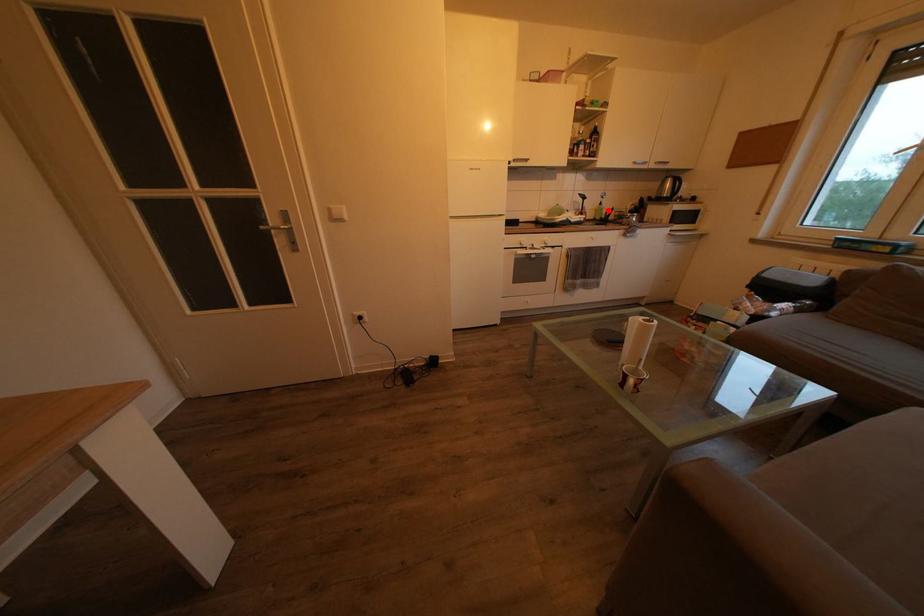
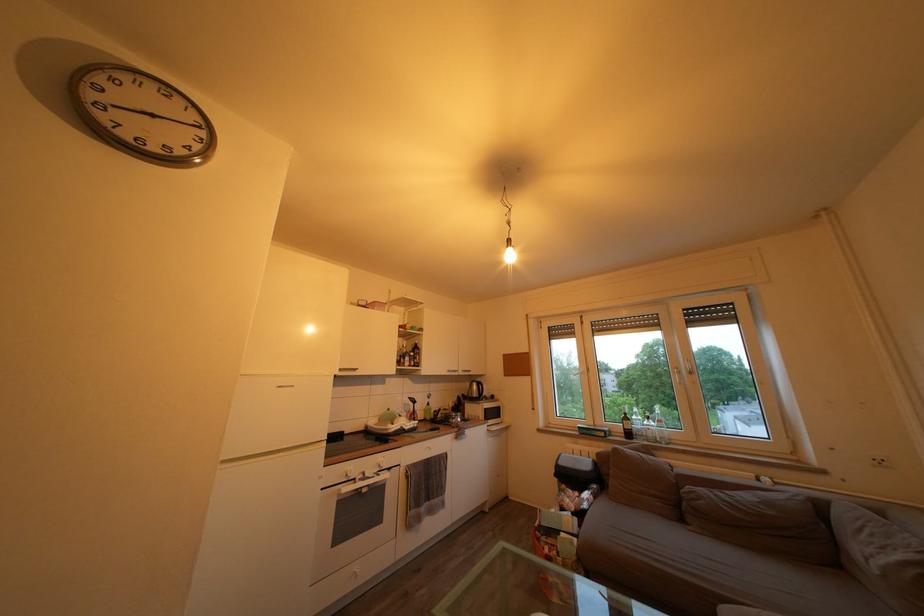
Question: I am providing you with two images of the same scene from different viewpoints. Image1 has a red point marked. In image2, the corresponding 3D location appears at what relative position? Reply with the corresponding letter.

Choices:
 (A) Closer
 (B) Farther

Answer: (B)